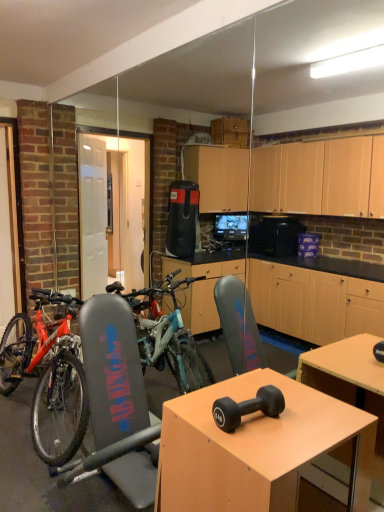
Question: Could you tell me if shiny metallic bicycle at left is facing matte wood desk at center?

Choices:
 (A) yes
 (B) no

Answer: (B)

Question: Is shiny metallic bicycle at left bigger than matte wood desk at center?

Choices:
 (A) yes
 (B) no

Answer: (A)

Question: Can you confirm if shiny metallic bicycle at left is thinner than matte wood desk at center?

Choices:
 (A) yes
 (B) no

Answer: (B)

Question: Is shiny metallic bicycle at left wider than matte wood desk at center?

Choices:
 (A) no
 (B) yes

Answer: (B)

Question: From the image's perspective, does shiny metallic bicycle at left appear lower than matte wood desk at center?

Choices:
 (A) yes
 (B) no

Answer: (B)

Question: Do you think black rubber dumbbell at center is within shiny metallic bicycle at left, or outside of it?

Choices:
 (A) inside
 (B) outside

Answer: (B)

Question: From the image's perspective, is black rubber dumbbell at center located above or below shiny metallic bicycle at left?

Choices:
 (A) below
 (B) above

Answer: (B)

Question: In the image, is black rubber dumbbell at center positioned in front of or behind shiny metallic bicycle at left?

Choices:
 (A) front
 (B) behind

Answer: (A)

Question: In terms of height, does black rubber dumbbell at center look taller or shorter compared to shiny metallic bicycle at left?

Choices:
 (A) tall
 (B) short

Answer: (B)

Question: Considering the positions of point pos(274,397) and point pos(210,472), is point pos(274,397) closer or farther from the camera than point pos(210,472)?

Choices:
 (A) farther
 (B) closer

Answer: (A)

Question: From the image's perspective, is black rubber dumbbell at center above or below matte wood desk at center?

Choices:
 (A) below
 (B) above

Answer: (B)

Question: Choose the correct answer: Is black rubber dumbbell at center inside matte wood desk at center or outside it?

Choices:
 (A) inside
 (B) outside

Answer: (B)

Question: Looking at their shapes, would you say black rubber dumbbell at center is wider or thinner than matte wood desk at center?

Choices:
 (A) wide
 (B) thin

Answer: (B)

Question: Is matte wood desk at center wider or thinner than black rubber dumbbell at center?

Choices:
 (A) wide
 (B) thin

Answer: (A)

Question: In the image, is matte wood desk at center positioned in front of or behind black rubber dumbbell at center?

Choices:
 (A) front
 (B) behind

Answer: (A)